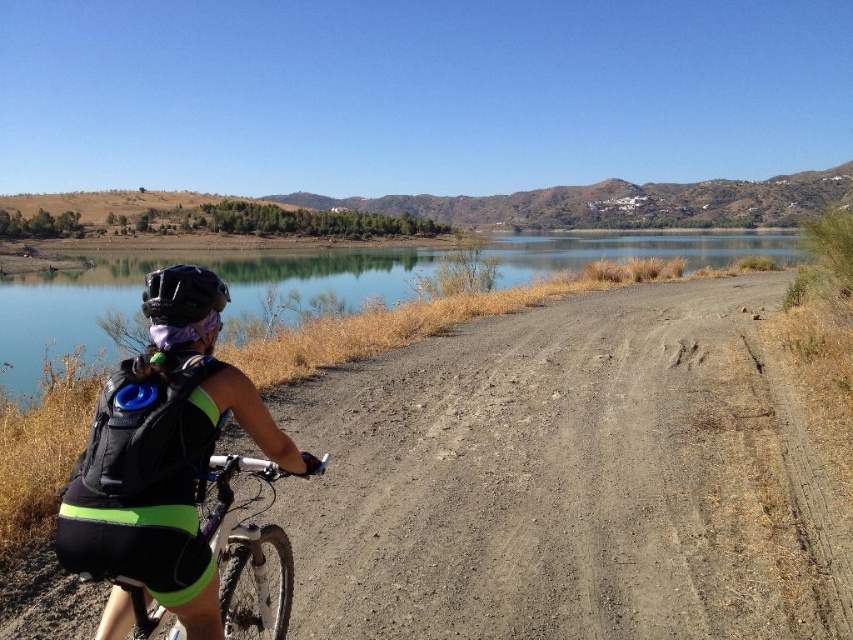
Is point (311, 620) positioned behind point (647, 243)?

That is False.

Does dirt/gravel road at center appear on the right side of clear blue water at center?

In fact, dirt/gravel road at center is to the left of clear blue water at center.

This screenshot has height=640, width=853. In order to click on dirt/gravel road at center in this screenshot , I will do click(572, 480).

Who is higher up, silver metallic bicycle at center-left or black matte helmet at center?

black matte helmet at center is above.

Is silver metallic bicycle at center-left bigger than black matte helmet at center?

Actually, silver metallic bicycle at center-left might be smaller than black matte helmet at center.

The width and height of the screenshot is (853, 640). What do you see at coordinates (247, 547) in the screenshot?
I see `silver metallic bicycle at center-left` at bounding box center [247, 547].

Locate an element on the screen. Image resolution: width=853 pixels, height=640 pixels. silver metallic bicycle at center-left is located at coordinates (247, 547).

Between point (799, 524) and point (181, 276), which one is positioned behind?

The point (799, 524) is more distant.

Is dirt/gravel road at center to the right of black matte helmet at center from the viewer's perspective?

Indeed, dirt/gravel road at center is positioned on the right side of black matte helmet at center.

Find the location of a particular element. Image resolution: width=853 pixels, height=640 pixels. dirt/gravel road at center is located at coordinates (572, 480).